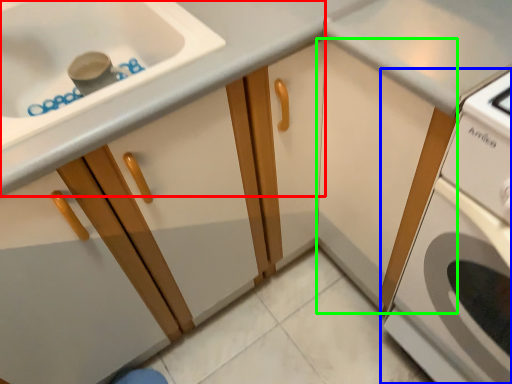
Question: Which object is the farthest from cabinetry (highlighted by a red box)? Choose among these: home appliance (highlighted by a blue box) or cabinetry (highlighted by a green box).

Choices:
 (A) home appliance
 (B) cabinetry

Answer: (A)